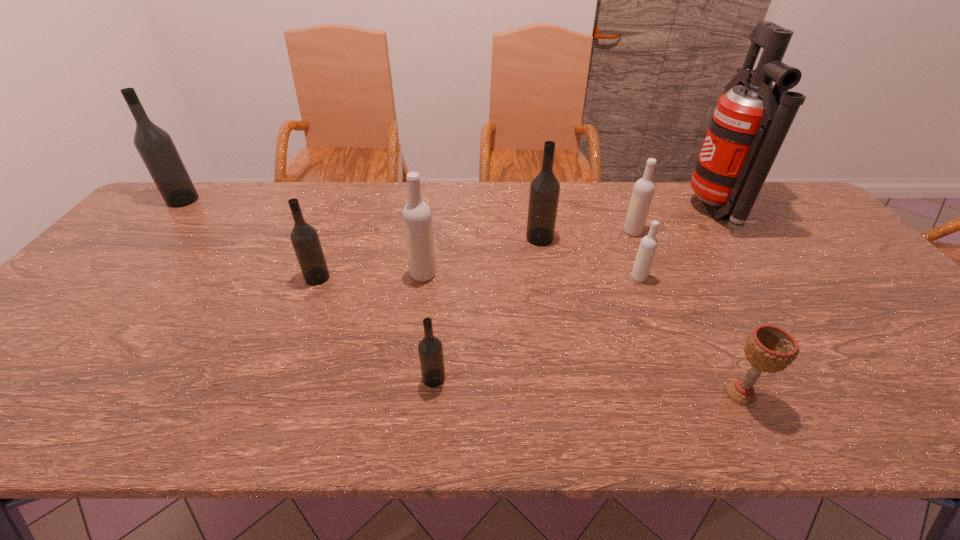
Identify which white vodka is the third nearest to the smallest black vodka. Please provide its 2D coordinates. Your answer should be formatted as a tuple, i.e. [(x, y)], where the tuple contains the x and y coordinates of a point satisfying the conditions above.

[(644, 188)]

Identify which white vodka is the closest to the leftmost white vodka. Please provide its 2D coordinates. Your answer should be formatted as a tuple, i.e. [(x, y)], where the tuple contains the x and y coordinates of a point satisfying the conditions above.

[(648, 245)]

Find the location of a particular element. This screenshot has height=540, width=960. free location that satisfies the following two spatial constraints: 1. on the front side of the leftmost white vodka; 2. on the right side of the farthest black vodka is located at coordinates (114, 274).

You are a GUI agent. You are given a task and a screenshot of the screen. Output one action in this format:
    pyautogui.click(x=<x>, y=<y>)
    Task: Click on the vacant space that satisfies the following two spatial constraints: 1. on the front side of the leftmost black vodka; 2. on the right side of the third black vodka from right to left
    The height and width of the screenshot is (540, 960).
    Given the screenshot: What is the action you would take?
    pyautogui.click(x=111, y=278)

At what (x,y) coordinates should I click in order to perform the action: click on vacant area that satisfies the following two spatial constraints: 1. on the back side of the leftmost white vodka; 2. on the left side of the sixth vodka from right to left. Please return your answer as a coordinate pair (x, y). Looking at the image, I should click on (319, 274).

Locate an element on the screen. free space that satisfies the following two spatial constraints: 1. on the front side of the biggest black vodka; 2. on the left side of the chalice is located at coordinates (3, 394).